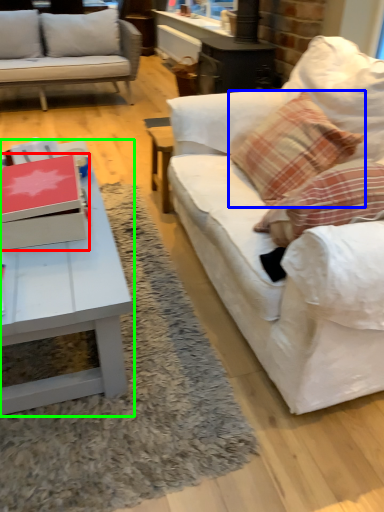
Question: Based on their relative distances, which object is farther from box (highlighted by a red box)? Choose from pillow (highlighted by a blue box) and coffee table (highlighted by a green box).

Choices:
 (A) pillow
 (B) coffee table

Answer: (A)